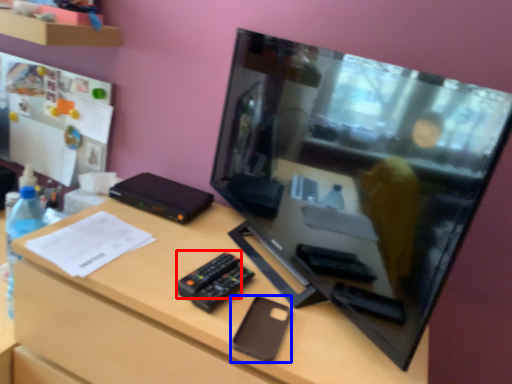
Question: Among these objects, which one is nearest to the camera, remote (highlighted by a red box) or gadget (highlighted by a blue box)?

Choices:
 (A) remote
 (B) gadget

Answer: (B)